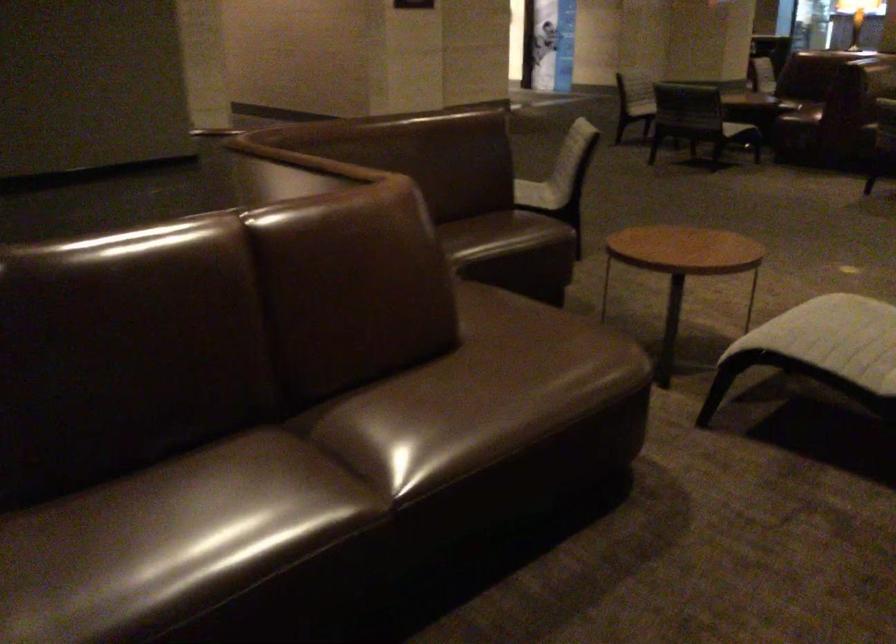
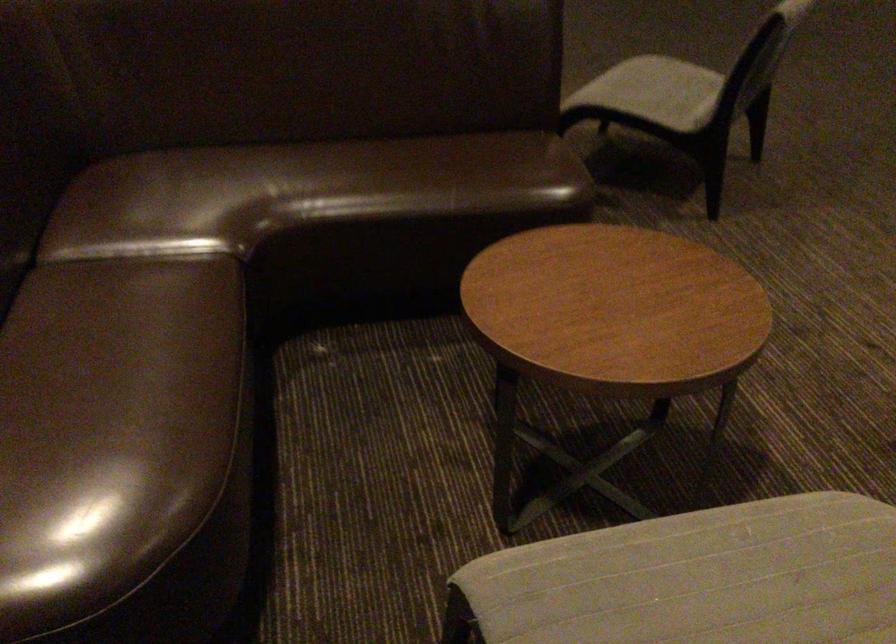
Find the pixel in the second image that matches (536,184) in the first image.

(655, 91)